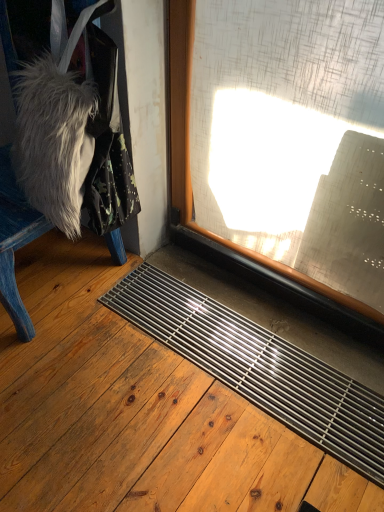
The image size is (384, 512). What do you see at coordinates (15, 243) in the screenshot?
I see `blue painted wood chair at left` at bounding box center [15, 243].

Find the location of a particular element. This screenshot has width=384, height=512. blue painted wood chair at left is located at coordinates (15, 243).

This screenshot has width=384, height=512. In order to click on furniture on the left of the transparent glass window at center in this screenshot , I will do `click(15, 243)`.

Based on the photo, are transparent glass window at center and blue painted wood chair at left making contact?

No, transparent glass window at center is not making contact with blue painted wood chair at left.

Considering the sizes of objects transparent glass window at center and blue painted wood chair at left in the image provided, who is bigger, transparent glass window at center or blue painted wood chair at left?

With larger size is blue painted wood chair at left.

Could you tell me if transparent glass window at center is turned towards blue painted wood chair at left?

No, transparent glass window at center is not oriented towards blue painted wood chair at left.

Considering the sizes of transparent glass window at center and metallic grid at lower center in the image, is transparent glass window at center bigger or smaller than metallic grid at lower center?

Considering their sizes, transparent glass window at center takes up less space than metallic grid at lower center.

How distant is transparent glass window at center from metallic grid at lower center?

They are 14.73 inches apart.

Can you confirm if transparent glass window at center is positioned to the right of metallic grid at lower center?

Yes, transparent glass window at center is to the right of metallic grid at lower center.

How many degrees apart are the facing directions of transparent glass window at center and metallic grid at lower center?

89.2 degrees separate the facing orientations of transparent glass window at center and metallic grid at lower center.

In the scene shown: Can you confirm if metallic grid at lower center is positioned to the left of transparent glass window at center?

Yes, metallic grid at lower center is to the left of transparent glass window at center.

Considering their positions, is metallic grid at lower center located in front of or behind transparent glass window at center?

metallic grid at lower center is positioned closer to the viewer than transparent glass window at center.

Consider the image. Between metallic grid at lower center and blue painted wood chair at left, which one has smaller width?

blue painted wood chair at left.

Is metallic grid at lower center touching blue painted wood chair at left?

No, metallic grid at lower center is not in contact with blue painted wood chair at left.

Considering the points (171, 338) and (13, 256), which point is in front, point (171, 338) or point (13, 256)?

The point (13, 256) is closer.

From the picture: Can you confirm if metallic grid at lower center is smaller than blue painted wood chair at left?

Yes, metallic grid at lower center is smaller than blue painted wood chair at left.

Find the location of a particular element. The height and width of the screenshot is (512, 384). doormat on the right of blue painted wood chair at left is located at coordinates (258, 367).

Does blue painted wood chair at left have a lesser width compared to metallic grid at lower center?

Indeed, blue painted wood chair at left has a lesser width compared to metallic grid at lower center.

From a real-world perspective, which object rests below the other?

metallic grid at lower center.

In terms of height, does blue painted wood chair at left look taller or shorter compared to metallic grid at lower center?

blue painted wood chair at left is taller than metallic grid at lower center.

Is blue painted wood chair at left completely or partially outside of transparent glass window at center?

Yes.

Is blue painted wood chair at left looking in the opposite direction of transparent glass window at center?

blue painted wood chair at left does not have its back to transparent glass window at center.

From the image's perspective, which is above, blue painted wood chair at left or transparent glass window at center?

blue painted wood chair at left, from the image's perspective.

Where is `furniture above the transparent glass window at center (from a real-world perspective)`? furniture above the transparent glass window at center (from a real-world perspective) is located at coordinates (15, 243).

You are a GUI agent. You are given a task and a screenshot of the screen. Output one action in this format:
    pyautogui.click(x=<x>, y=<y>)
    Task: Click on the furniture above the transparent glass window at center (from the image's perspective)
    
    Given the screenshot: What is the action you would take?
    pyautogui.click(x=15, y=243)

This screenshot has width=384, height=512. Identify the location of doormat in front of the transparent glass window at center. (258, 367).

From the image, which object appears to be nearer to metallic grid at lower center, blue painted wood chair at left or transparent glass window at center?

transparent glass window at center is positioned closer to the anchor metallic grid at lower center.

Based on their spatial positions, is metallic grid at lower center or transparent glass window at center closer to blue painted wood chair at left?

transparent glass window at center is positioned closer to the anchor blue painted wood chair at left.

Based on their spatial positions, is transparent glass window at center or metallic grid at lower center further from blue painted wood chair at left?

The object further to blue painted wood chair at left is metallic grid at lower center.

Estimate the real-world distances between objects in this image. Which object is further from transparent glass window at center, metallic grid at lower center or blue painted wood chair at left?

blue painted wood chair at left is positioned further to the anchor transparent glass window at center.

Based on their spatial positions, is blue painted wood chair at left or metallic grid at lower center closer to transparent glass window at center?

The object closer to transparent glass window at center is metallic grid at lower center.

Which object lies nearer to the anchor point metallic grid at lower center, transparent glass window at center or blue painted wood chair at left?

transparent glass window at center is positioned closer to the anchor metallic grid at lower center.

Locate an element on the screen. The height and width of the screenshot is (512, 384). doormat situated between blue painted wood chair at left and transparent glass window at center from left to right is located at coordinates (258, 367).